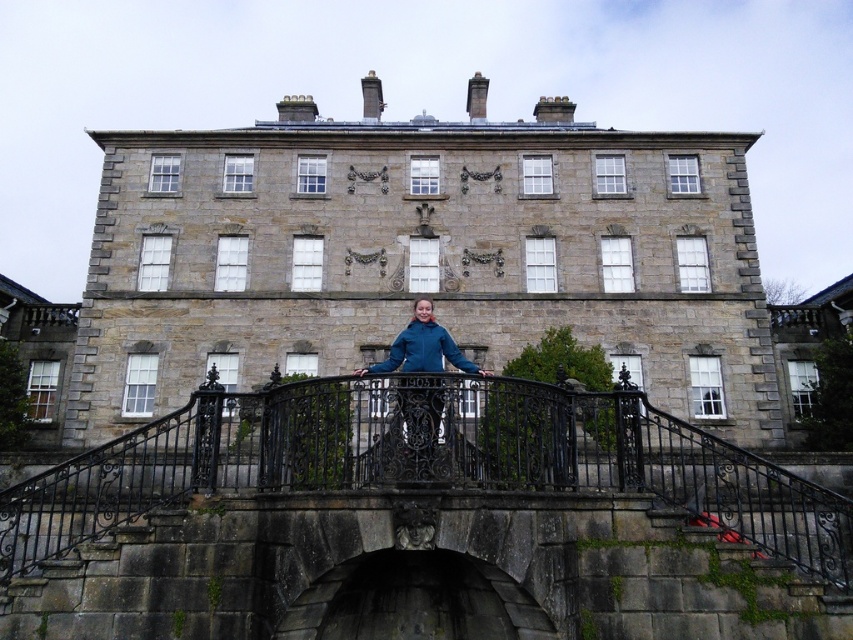
Question: Which point is farther to the camera?

Choices:
 (A) (555, 401)
 (B) (393, 433)

Answer: (A)

Question: In this image, where is black wrought iron bridge at center located relative to blue fleece jacket at center?

Choices:
 (A) above
 (B) below

Answer: (B)

Question: Does blue fabric jacket at center have a greater width compared to blue fleece jacket at center?

Choices:
 (A) no
 (B) yes

Answer: (A)

Question: Which object appears closest to the camera in this image?

Choices:
 (A) blue fabric jacket at center
 (B) blue fleece jacket at center
 (C) black wrought iron bridge at center

Answer: (C)

Question: Is black wrought iron bridge at center below blue fleece jacket at center?

Choices:
 (A) yes
 (B) no

Answer: (A)

Question: Which object is farther from the camera taking this photo?

Choices:
 (A) blue fabric jacket at center
 (B) blue fleece jacket at center

Answer: (B)